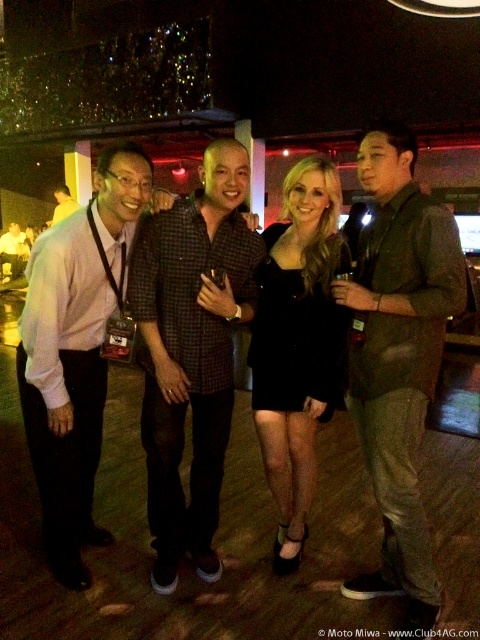
Looking at this image, you are a photographer at the event and want to ensure all attendees in the photo are visible. Given that the checkered fabric shirt at center and the light pink shirt at left are in the frame, which one is smaller and might need to be moved closer to the camera for better visibility?

The checkered fabric shirt at center is smaller than the light pink shirt at left, so it might need to be moved closer to the camera for better visibility.

You are at a party and want to take a photo of the shiny dark gray suit at right and the matte black shirt at left. Which one should you focus on first if you want to capture both in the same frame without moving the camera?

You should focus on the matte black shirt at left first because it is closer to the camera than the shiny dark gray suit at right.